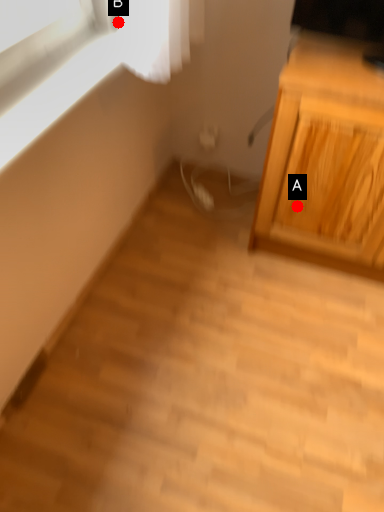
Question: Two points are circled on the image, labeled by A and B beside each circle. Which point is farther to the camera?

Choices:
 (A) A is further
 (B) B is further

Answer: (A)